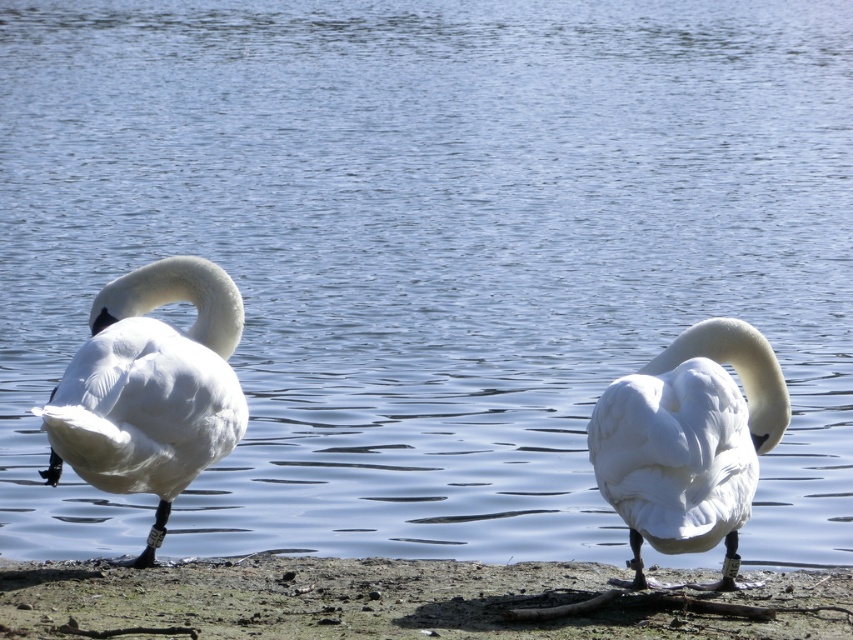
Is white feathered swan at left above white glossy swan at center?

Yes.

Who is more forward, (175, 275) or (727, 321)?

Point (727, 321)

Image resolution: width=853 pixels, height=640 pixels. Find the location of `white feathered swan at left`. white feathered swan at left is located at coordinates (149, 387).

Can you confirm if muddy sand at lower center is thinner than white glossy swan at center?

No.

Based on the photo, can you confirm if muddy sand at lower center is positioned to the left of white glossy swan at center?

Correct, you'll find muddy sand at lower center to the left of white glossy swan at center.

Which is in front, point (653, 627) or point (642, 456)?

Point (653, 627) is in front.

Locate an element on the screen. muddy sand at lower center is located at coordinates (402, 600).

Between muddy sand at lower center and white feathered swan at left, which one appears on the left side from the viewer's perspective?

white feathered swan at left

Can you confirm if muddy sand at lower center is positioned to the left of white feathered swan at left?

No, muddy sand at lower center is not to the left of white feathered swan at left.

The image size is (853, 640). Describe the element at coordinates (402, 600) in the screenshot. I see `muddy sand at lower center` at that location.

You are a GUI agent. You are given a task and a screenshot of the screen. Output one action in this format:
    pyautogui.click(x=<x>, y=<y>)
    Task: Click on the muddy sand at lower center
    
    Given the screenshot: What is the action you would take?
    pyautogui.click(x=402, y=600)